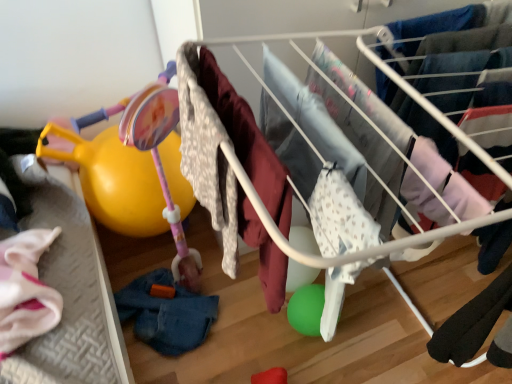
Question: Which direction should I rotate to face fluffy white blanket at center, the 1th clothing viewed from the top, — up or down?

Choices:
 (A) down
 (B) up

Answer: (A)

Question: From the image's perspective, would you say fluffy white blanket at center, the second clothing when ordered from bottom to top, is shown under denim at lower left, which appears as the 2th clothing when viewed from the right?

Choices:
 (A) no
 (B) yes

Answer: (A)

Question: Would you say fluffy white blanket at center, which is the 1th clothing from front to back, contains denim at lower left, arranged as the first clothing when ordered from the bottom?

Choices:
 (A) no
 (B) yes

Answer: (A)

Question: Is fluffy white blanket at center, the 2th clothing in the left-to-right sequence, not near denim at lower left, arranged as the first clothing when ordered from the bottom?

Choices:
 (A) yes
 (B) no

Answer: (B)

Question: Does fluffy white blanket at center, which is the 1th clothing from front to back, come behind denim at lower left, arranged as the first clothing when ordered from the bottom?

Choices:
 (A) no
 (B) yes

Answer: (A)

Question: Is fluffy white blanket at center, the second clothing when ordered from bottom to top, in front of denim at lower left, which is the 2th clothing in top-to-bottom order?

Choices:
 (A) no
 (B) yes

Answer: (B)

Question: Is fluffy white blanket at center, the 1th clothing viewed from the top, outside of denim at lower left, which appears as the 2th clothing when viewed from the right?

Choices:
 (A) yes
 (B) no

Answer: (A)

Question: Does white fabric baby clothes at center turn towards matte pink plastic baby carriage at left?

Choices:
 (A) yes
 (B) no

Answer: (B)

Question: From a real-world perspective, is white fabric baby clothes at center located higher than matte pink plastic baby carriage at left?

Choices:
 (A) no
 (B) yes

Answer: (B)

Question: Is white fabric baby clothes at center thinner than matte pink plastic baby carriage at left?

Choices:
 (A) yes
 (B) no

Answer: (B)

Question: Does white fabric baby clothes at center have a larger size compared to matte pink plastic baby carriage at left?

Choices:
 (A) yes
 (B) no

Answer: (B)

Question: Is white fabric baby clothes at center to the left of matte pink plastic baby carriage at left from the viewer's perspective?

Choices:
 (A) no
 (B) yes

Answer: (A)

Question: From the image's perspective, does white fabric baby clothes at center appear lower than matte pink plastic baby carriage at left?

Choices:
 (A) yes
 (B) no

Answer: (A)

Question: Does denim at lower left, which appears as the 2th clothing when viewed from the right, contain matte pink plastic baby carriage at left?

Choices:
 (A) no
 (B) yes

Answer: (A)